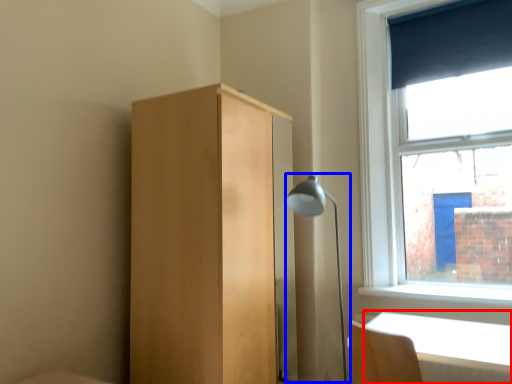
Question: Which object appears farthest to the camera in this image, table (highlighted by a red box) or lamp (highlighted by a blue box)?

Choices:
 (A) table
 (B) lamp

Answer: (B)